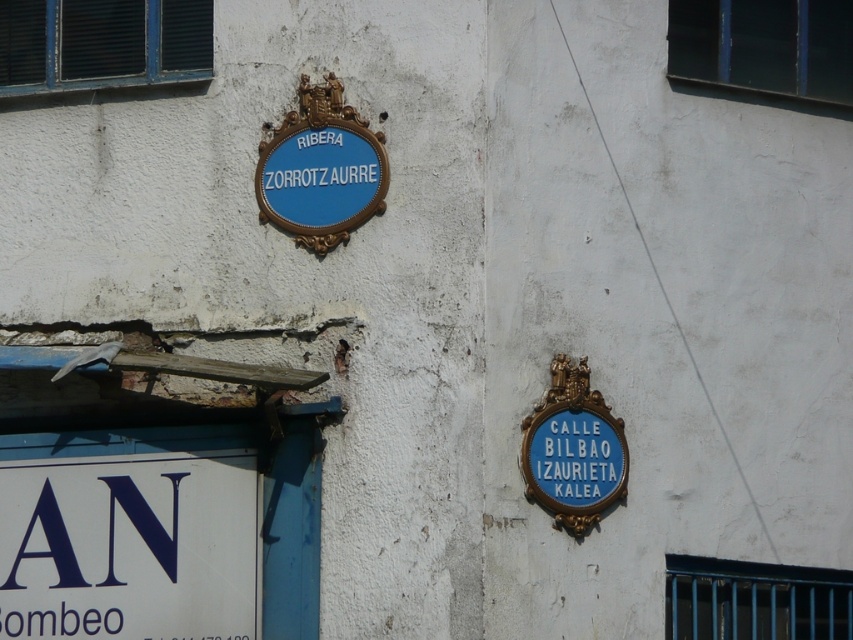
Question: Which object appears closest to the camera in this image?

Choices:
 (A) white plastic sign at lower left
 (B) blue painted wood sign at right
 (C) blue glossy sign at upper left

Answer: (B)

Question: Which point appears farthest from the camera in this image?

Choices:
 (A) (558, 504)
 (B) (262, 202)

Answer: (B)

Question: Does blue glossy sign at upper left appear over blue painted wood sign at right?

Choices:
 (A) yes
 (B) no

Answer: (A)

Question: Estimate the real-world distances between objects in this image. Which object is closer to the blue glossy sign at upper left?

Choices:
 (A) blue painted wood sign at right
 (B) white plastic sign at lower left

Answer: (B)

Question: Is white plastic sign at lower left further to the viewer compared to blue glossy sign at upper left?

Choices:
 (A) yes
 (B) no

Answer: (B)

Question: Is blue glossy sign at upper left positioned in front of blue painted wood sign at right?

Choices:
 (A) no
 (B) yes

Answer: (A)